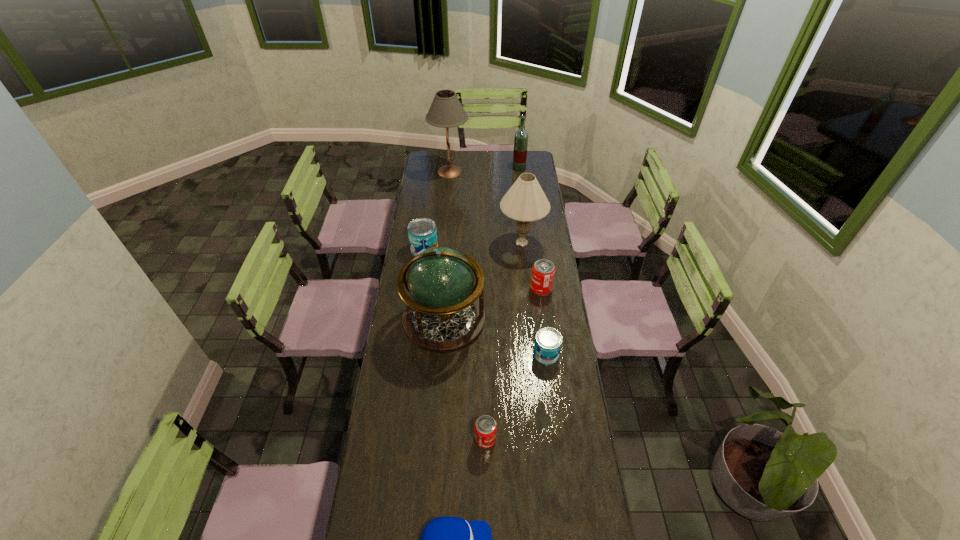
At what (x,y) coordinates should I click in order to perform the action: click on table lamp. Please return your answer as a coordinate pair (x, y). The width and height of the screenshot is (960, 540). Looking at the image, I should click on (446, 111).

You are a GUI agent. You are given a task and a screenshot of the screen. Output one action in this format:
    pyautogui.click(x=<x>, y=<y>)
    Task: Click on the lampshade
    The image size is (960, 540).
    Given the screenshot: What is the action you would take?
    pyautogui.click(x=525, y=201)

At what (x,y) coordinates should I click in order to perform the action: click on globe. Please return your answer as a coordinate pair (x, y). The image size is (960, 540). Looking at the image, I should click on (445, 314).

At what (x,y) coordinates should I click in order to perform the action: click on green liquor. Please return your answer as a coordinate pair (x, y). Looking at the image, I should click on (521, 136).

You are a GUI agent. You are given a task and a screenshot of the screen. Output one action in this format:
    pyautogui.click(x=<x>, y=<y>)
    Task: Click on the third nearest can
    This screenshot has height=540, width=960.
    Given the screenshot: What is the action you would take?
    pyautogui.click(x=543, y=271)

In order to click on the right red can in this screenshot , I will do `click(543, 271)`.

Locate an element on the screen. Image resolution: width=960 pixels, height=540 pixels. the farther blue can is located at coordinates (422, 232).

Find the location of a particular element. the left blue can is located at coordinates (422, 232).

Where is `the left red can`? the left red can is located at coordinates (485, 428).

At what (x,y) coordinates should I click in order to perform the action: click on the smaller red can. Please return your answer as a coordinate pair (x, y). The height and width of the screenshot is (540, 960). Looking at the image, I should click on (485, 428).